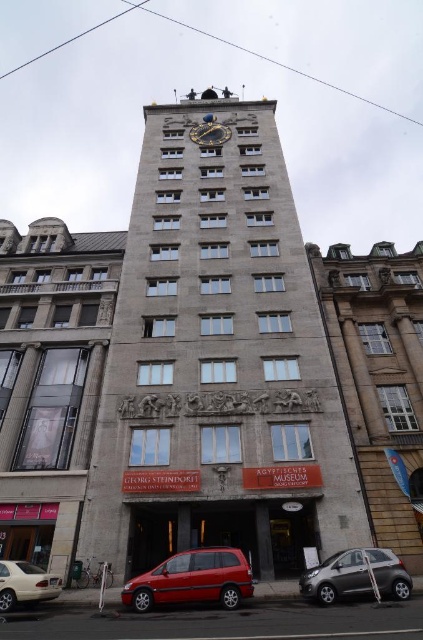
You are standing in front of the building and notice a point marked at coordinates (216, 362). What is located at that point?

The point at coordinates (216, 362) is where the gray stone clock tower at center is located.

You are a photographer trying to capture the entire matte stone building at left and the shiny red minivan at lower center in one frame. Given their sizes, which object should you position closer to the camera to ensure both fit in the shot?

Since the matte stone building at left is larger in size than the shiny red minivan at lower center, you should position the shiny red minivan at lower center closer to the camera to balance their sizes in the frame.

You are standing in front of the building and notice two points marked on the facade. The first point is at coordinates point (x=21, y=358) and the second is at point (x=123, y=595). Which point is closer to you?

Point (x=21, y=358) is further to the camera than point (x=123, y=595). Therefore, the point closer to you is point (x=123, y=595).